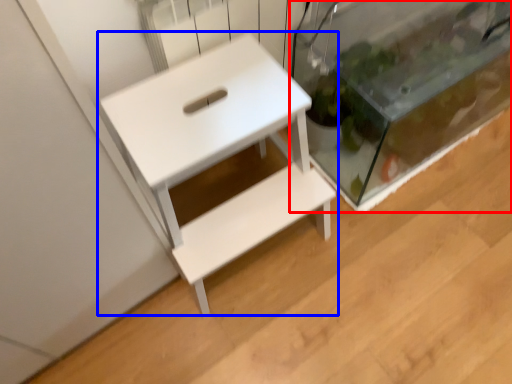
Question: Which object appears closest to the camera in this image, glass box (highlighted by a red box) or table (highlighted by a blue box)?

Choices:
 (A) glass box
 (B) table

Answer: (B)